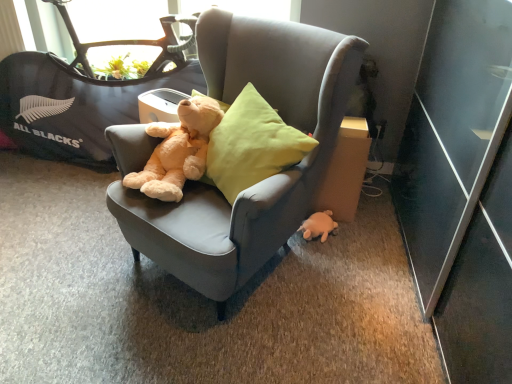
What do you see at coordinates (264, 180) in the screenshot? The height and width of the screenshot is (384, 512). I see `velvet gray chair at center` at bounding box center [264, 180].

What is the approximate width of light brown plush teddy bear at center?

The width of light brown plush teddy bear at center is 20.38 inches.

Where is `cardboard at right`? The height and width of the screenshot is (384, 512). cardboard at right is located at coordinates (345, 171).

Where is `black fabric baby carriage at upper left`? The image size is (512, 384). black fabric baby carriage at upper left is located at coordinates [x=83, y=96].

Image resolution: width=512 pixels, height=384 pixels. In order to click on velvet gray chair at center in this screenshot , I will do `click(264, 180)`.

Could you tell me if cardboard at right is turned towards white plush turtle at lower right?

Yes, cardboard at right is oriented towards white plush turtle at lower right.

In the scene shown: Is cardboard at right bigger than white plush turtle at lower right?

Yes, cardboard at right is bigger than white plush turtle at lower right.

Based on the photo, which is correct: cardboard at right is inside white plush turtle at lower right, or outside of it?

cardboard at right is located beyond the bounds of white plush turtle at lower right.

Between cardboard at right and white plush turtle at lower right, which one appears on the right side from the viewer's perspective?

cardboard at right.

Which is more to the left, cardboard at right or black fabric baby carriage at upper left?

black fabric baby carriage at upper left is more to the left.

Can you see cardboard at right touching black fabric baby carriage at upper left?

There is a gap between cardboard at right and black fabric baby carriage at upper left.

Which of these two, cardboard at right or black fabric baby carriage at upper left, is smaller?

With smaller size is cardboard at right.

What's the angular difference between cardboard at right and black fabric baby carriage at upper left's facing directions?

They differ by 3.84 degrees in their facing directions.

From a real-world perspective, is light brown plush teddy bear at center over white plush turtle at lower right?

Yes.

Considering their positions, is light brown plush teddy bear at center located in front of or behind white plush turtle at lower right?

In the image, light brown plush teddy bear at center appears in front of white plush turtle at lower right.

Which of these two, light brown plush teddy bear at center or white plush turtle at lower right, is smaller?

white plush turtle at lower right.

Is light brown plush teddy bear at center thinner than white plush turtle at lower right?

No.

Does velvet gray chair at center have a smaller size compared to black fabric baby carriage at upper left?

No.

Is velvet gray chair at center to the right of black fabric baby carriage at upper left from the viewer's perspective?

Yes.

Can you confirm if velvet gray chair at center is shorter than black fabric baby carriage at upper left?

Incorrect, the height of velvet gray chair at center does not fall short of that of black fabric baby carriage at upper left.

Image resolution: width=512 pixels, height=384 pixels. In order to click on baby carriage that is under the velvet gray chair at center (from a real-world perspective) in this screenshot , I will do `click(83, 96)`.

Based on the photo, from the image's perspective, between white plush turtle at lower right and cardboard at right, who is located below?

From the image's view, white plush turtle at lower right is below.

At what (x,y) coordinates should I click in order to perform the action: click on toy beneath the cardboard at right (from a real-world perspective). Please return your answer as a coordinate pair (x, y). The image size is (512, 384). Looking at the image, I should click on (318, 226).

From the picture: Can you tell me how much white plush turtle at lower right and cardboard at right differ in facing direction?

The angular difference between white plush turtle at lower right and cardboard at right is 32.7 degrees.

Does cardboard at right have a lesser height compared to velvet gray chair at center?

Correct, cardboard at right is not as tall as velvet gray chair at center.

Which object is positioned more to the left, cardboard at right or velvet gray chair at center?

velvet gray chair at center.

Considering the sizes of objects cardboard at right and velvet gray chair at center in the image provided, who is smaller, cardboard at right or velvet gray chair at center?

Smaller between the two is cardboard at right.

Is black fabric baby carriage at upper left not near light brown plush teddy bear at center?

No, black fabric baby carriage at upper left is in close proximity to light brown plush teddy bear at center.

Is light brown plush teddy bear at center at the back of black fabric baby carriage at upper left?

black fabric baby carriage at upper left does not have its back to light brown plush teddy bear at center.

Is black fabric baby carriage at upper left inside or outside of light brown plush teddy bear at center?

black fabric baby carriage at upper left cannot be found inside light brown plush teddy bear at center.

This screenshot has width=512, height=384. Identify the location of baby carriage below the light brown plush teddy bear at center (from a real-world perspective). (83, 96).

At what (x,y) coordinates should I click in order to perform the action: click on cardboard box that appears above the white plush turtle at lower right (from the image's perspective). Please return your answer as a coordinate pair (x, y). Looking at the image, I should click on (345, 171).

What are the coordinates of `cardboard box that is below the black fabric baby carriage at upper left (from the image's perspective)` in the screenshot? It's located at (345, 171).

When comparing their distances from white plush turtle at lower right, does light brown plush teddy bear at center or cardboard at right seem further?

light brown plush teddy bear at center is positioned further to the anchor white plush turtle at lower right.

From the image, which object appears to be farther from light brown plush teddy bear at center, black fabric baby carriage at upper left or cardboard at right?

The object further to light brown plush teddy bear at center is black fabric baby carriage at upper left.

From the image, which object appears to be nearer to black fabric baby carriage at upper left, cardboard at right or light brown plush teddy bear at center?

light brown plush teddy bear at center lies closer to black fabric baby carriage at upper left than the other object.

When comparing their distances from velvet gray chair at center, does black fabric baby carriage at upper left or white plush turtle at lower right seem closer?

The object closer to velvet gray chair at center is white plush turtle at lower right.

From the image, which object appears to be nearer to black fabric baby carriage at upper left, cardboard at right or white plush turtle at lower right?

Among the two, cardboard at right is located nearer to black fabric baby carriage at upper left.

Consider the image. Based on their spatial positions, is velvet gray chair at center or black fabric baby carriage at upper left closer to white plush turtle at lower right?

velvet gray chair at center.

Based on the photo, which object lies further to the anchor point cardboard at right, black fabric baby carriage at upper left or light brown plush teddy bear at center?

black fabric baby carriage at upper left lies further to cardboard at right than the other object.

Estimate the real-world distances between objects in this image. Which object is further from white plush turtle at lower right, black fabric baby carriage at upper left or cardboard at right?

black fabric baby carriage at upper left is further to white plush turtle at lower right.

I want to click on chair between black fabric baby carriage at upper left and cardboard at right from left to right, so click(x=264, y=180).

Identify the location of teddy bear located between black fabric baby carriage at upper left and cardboard at right in the left-right direction. The width and height of the screenshot is (512, 384). (178, 150).

The width and height of the screenshot is (512, 384). I want to click on toy between velvet gray chair at center and black fabric baby carriage at upper left from front to back, so [x=318, y=226].

Image resolution: width=512 pixels, height=384 pixels. I want to click on teddy bear located between velvet gray chair at center and black fabric baby carriage at upper left in the depth direction, so click(x=178, y=150).